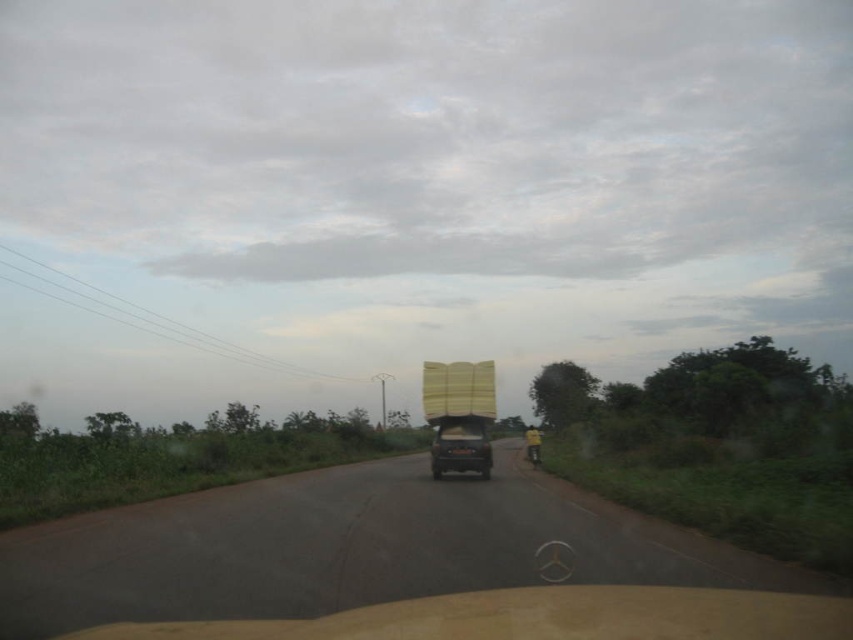
You are driving a car and see the asphalt road at center and wooden planks at center in front of you. Which one is positioned to the left from your perspective?

The asphalt road at center is positioned to the left of the wooden planks at center.